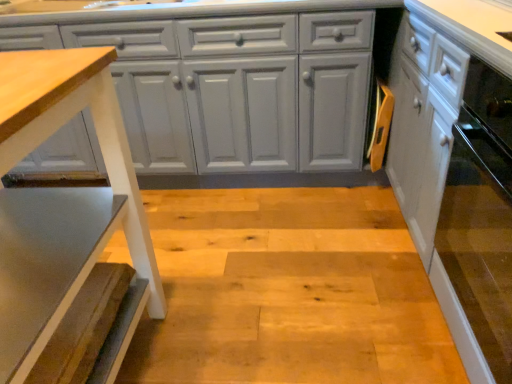
Question: Is white glossy cabinet at right, the first cabinetry viewed from the right, shorter than wooden textured step stool at left?

Choices:
 (A) yes
 (B) no

Answer: (B)

Question: Does white glossy cabinet at right, the first cabinetry viewed from the right, appear on the left side of wooden textured step stool at left?

Choices:
 (A) yes
 (B) no

Answer: (B)

Question: Considering the relative positions of white glossy cabinet at right, the first cabinetry viewed from the right, and wooden textured step stool at left in the image provided, is white glossy cabinet at right, the first cabinetry viewed from the right, to the right of wooden textured step stool at left from the viewer's perspective?

Choices:
 (A) yes
 (B) no

Answer: (A)

Question: Is white glossy cabinet at right, the first cabinetry viewed from the right, not inside wooden textured step stool at left?

Choices:
 (A) no
 (B) yes

Answer: (B)

Question: Could you tell me if white glossy cabinet at right, the first cabinetry viewed from the right, is turned towards wooden textured step stool at left?

Choices:
 (A) yes
 (B) no

Answer: (A)

Question: From the image's perspective, would you say white glossy cabinet at right, placed as the 2th cabinetry when sorted from left to right, is positioned over wooden textured step stool at left?

Choices:
 (A) no
 (B) yes

Answer: (B)

Question: Can you confirm if wooden textured step stool at left is positioned to the right of matte gray cabinet at center, which appears as the 1th cabinetry when viewed from the left?

Choices:
 (A) yes
 (B) no

Answer: (B)

Question: Is wooden textured step stool at left oriented towards matte gray cabinet at center, which ranks as the 2th cabinetry in right-to-left order?

Choices:
 (A) no
 (B) yes

Answer: (A)

Question: From the image's perspective, is wooden textured step stool at left located beneath matte gray cabinet at center, which appears as the 1th cabinetry when viewed from the left?

Choices:
 (A) no
 (B) yes

Answer: (B)

Question: Can matte gray cabinet at center, which appears as the 1th cabinetry when viewed from the left, be found inside wooden textured step stool at left?

Choices:
 (A) yes
 (B) no

Answer: (B)

Question: Is wooden textured step stool at left far from matte gray cabinet at center, which appears as the 1th cabinetry when viewed from the left?

Choices:
 (A) yes
 (B) no

Answer: (B)

Question: Is wooden textured step stool at left smaller than matte gray cabinet at center, which appears as the 1th cabinetry when viewed from the left?

Choices:
 (A) yes
 (B) no

Answer: (A)

Question: Is wooden textured step stool at left directly adjacent to white glossy cabinet at right, placed as the 2th cabinetry when sorted from left to right?

Choices:
 (A) yes
 (B) no

Answer: (B)